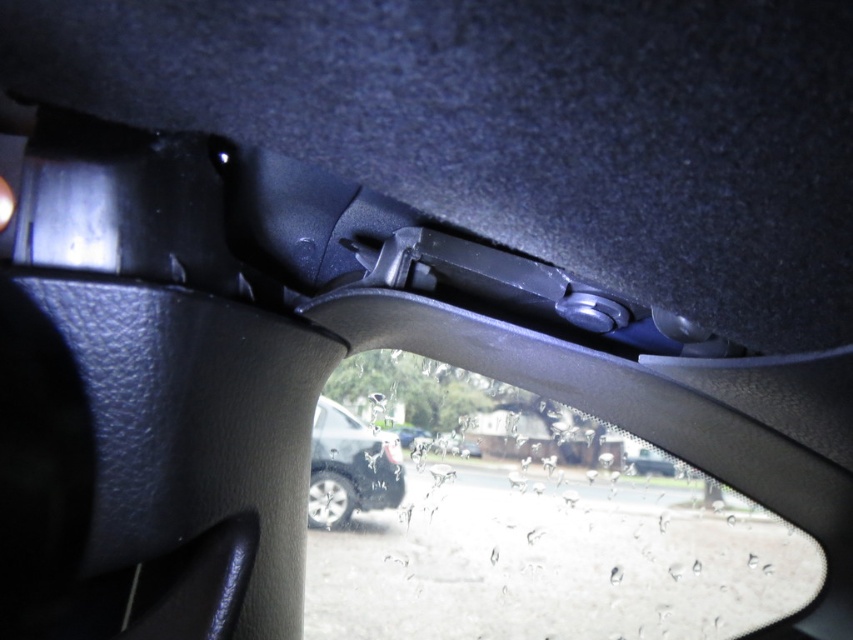
Is transparent plastic car window at center below satin silver car at center?

Correct, transparent plastic car window at center is located below satin silver car at center.

Who is lower down, transparent plastic car window at center or satin silver car at center?

Positioned lower is transparent plastic car window at center.

Where is `transparent plastic car window at center`? The width and height of the screenshot is (853, 640). transparent plastic car window at center is located at coordinates (544, 532).